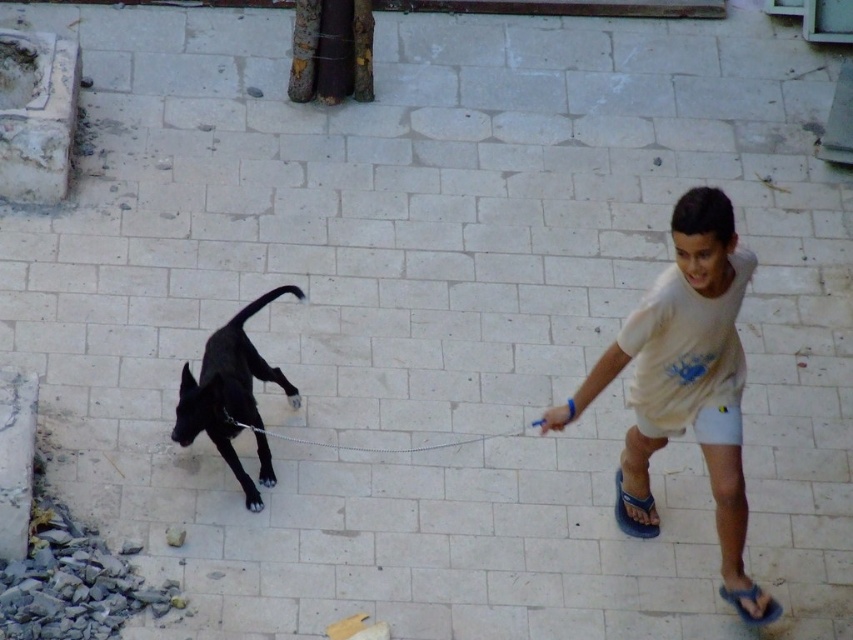
You are standing at the point labeled point (x=190, y=404) and want to walk to the point labeled point (x=416, y=448). Which direction should you move in to get closer to your destination?

You should move in the direction away from the camera because point (x=416, y=448) is further from the camera than point (x=190, y=404).

Where is the white cotton shirt at right located in the image?

The white cotton shirt at right is located at point 0.600 on the x axis and 0.805 on the y axis.

Based on the photo, you are a photographer trying to capture a candid shot of the scene. You notice the white cotton shirt at right and the silver chain leash at center. Which object should you focus on first to ensure it appears larger in your photo?

The white cotton shirt at right is taller than the silver chain leash at center, so focusing on it first will ensure it appears larger in the photo.